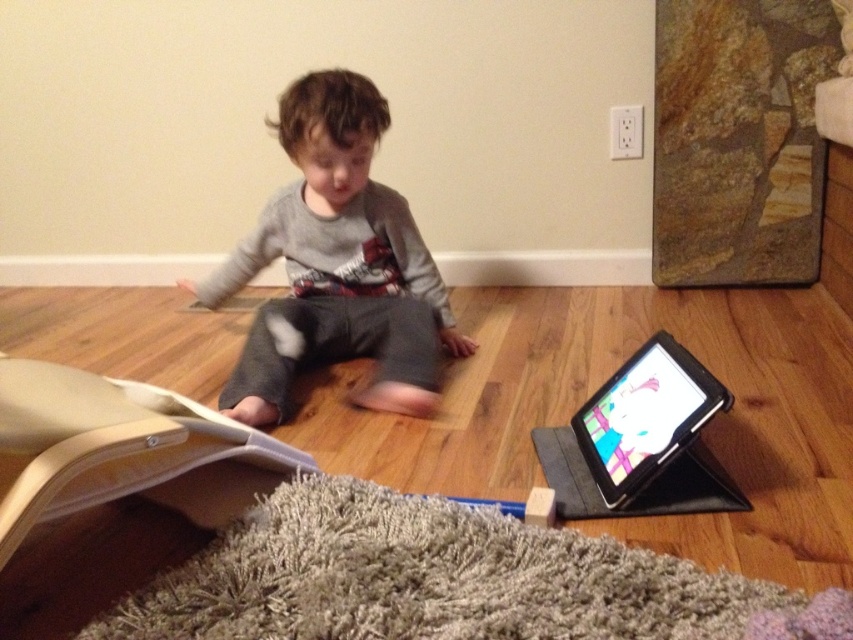
Which is more to the right, gray cotton shirt at center or black plastic tablet at lower right?

Positioned to the right is black plastic tablet at lower right.

Between point (415, 282) and point (625, 372), which one is positioned in front?

Point (625, 372) is in front.

Who is more forward, (323, 276) or (711, 404)?

Point (711, 404)

Identify the location of gray cotton shirt at center. (337, 262).